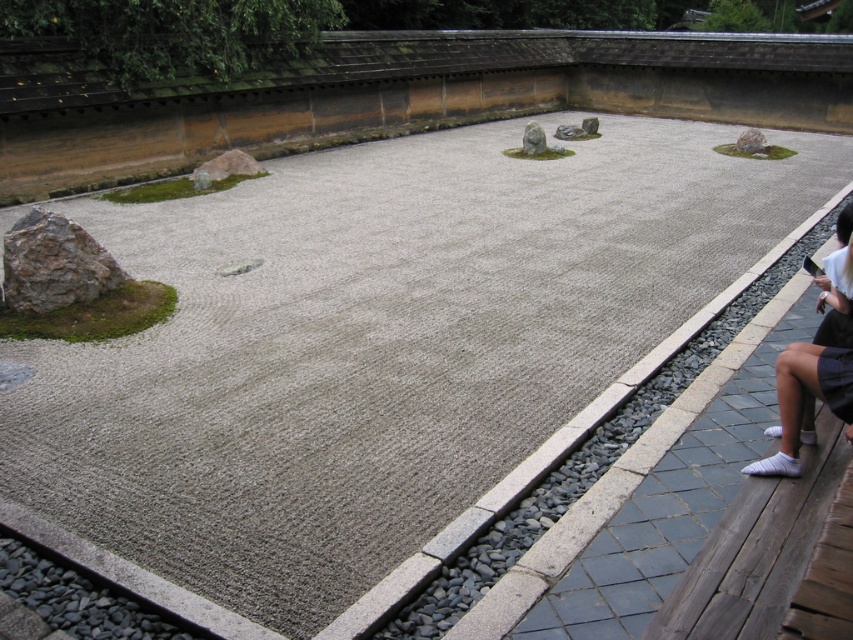
You are standing in the traditional Japanese Zen garden and want to place a small decorative item exactly at the center of the gravel field. However, you must avoid placing it near the white fabric at right. Based on the coordinates provided, can you determine if the center of the gravel field is safe to place the item?

The white fabric at right is located at coordinates point (805, 400). The center of the gravel field would be at the midpoint of the gravel area, which is likely at coordinates around (426, 320). Since the white fabric at right is positioned at (805, 400), which is far from the center, the center is safe to place the item without being near the white fabric at right.